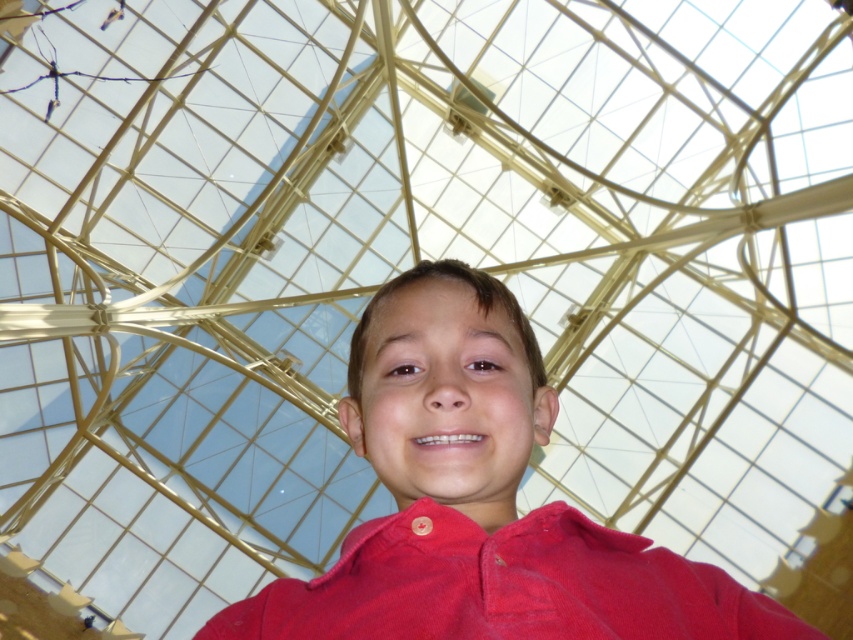
You are standing in a room with a geometric ceiling made of golden metal beams. You see two points marked on the ceiling at coordinates point (431, 401) and point (560, 515). If you want to touch the point that is closer to you, which coordinate should you aim for?

Point (431, 401) is further to the viewer than point (560, 515), so the closer point to aim for is point (431, 401).

The scene shows a boy wearing two shirts. The red matte shirt at center and the red corduroy polo shirt at center. Which shirt is bigger in size?

The red matte shirt at center is larger in size than the red corduroy polo shirt at center.

Where is the red matte shirt at center located in the image?

The red matte shirt at center is located at point (x=479, y=500) in the image.